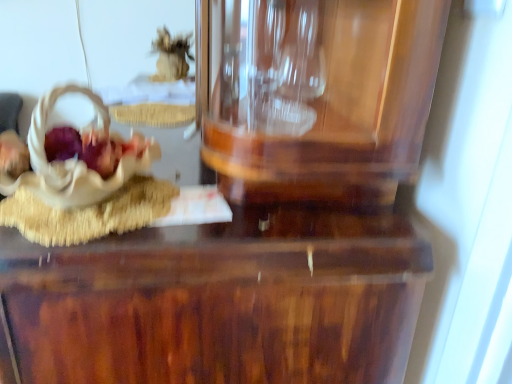
At what (x,y) coordinates should I click in order to perform the action: click on vacant area that lies to the right of matte brown basket at left. Please return your answer as a coordinate pair (x, y). This screenshot has width=512, height=384. Looking at the image, I should click on (211, 216).